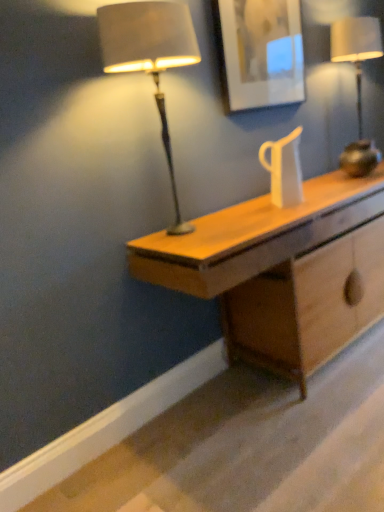
At what (x,y) coordinates should I click in order to perform the action: click on vacant space in matte brown lamp at left, positioned as the 1th lamp in left-to-right order (from a real-world perspective). Please return your answer as a coordinate pair (x, y). The image size is (384, 512). Looking at the image, I should click on (181, 233).